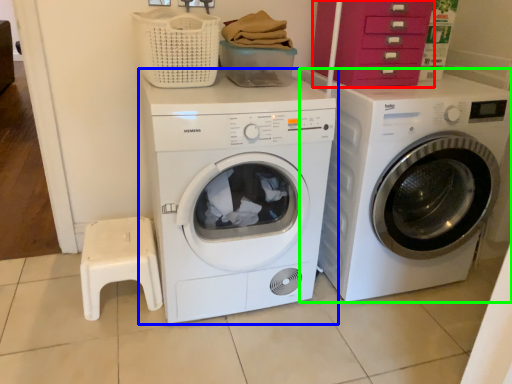
Question: Considering the real-world distances, which object is closest to drawer (highlighted by a red box)? washing machine (highlighted by a blue box) or washing machine (highlighted by a green box).

Choices:
 (A) washing machine
 (B) washing machine

Answer: (B)